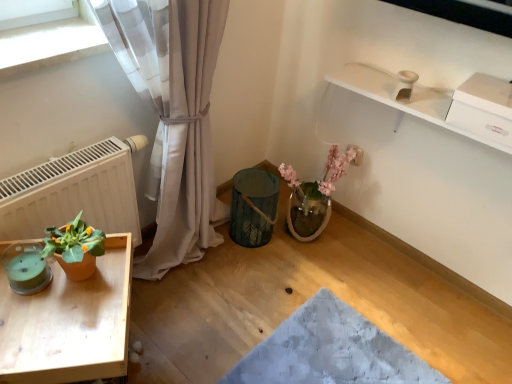
At what (x,y) coordinates should I click in order to perform the action: click on free spot in front of teal glass candle at lower left. Please return your answer as a coordinate pair (x, y). The image size is (512, 384). Looking at the image, I should click on (26, 324).